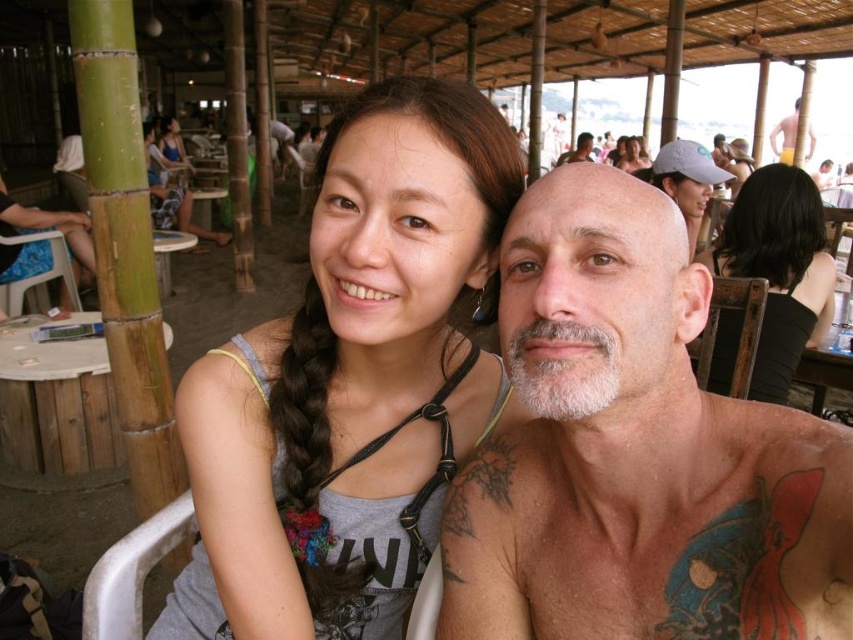
Does matte blue tank top at upper left have a lesser height compared to matte gray tank top at upper center?

In fact, matte blue tank top at upper left may be taller than matte gray tank top at upper center.

Between point (151, 196) and point (178, 129), which one is positioned behind?

Positioned behind is point (178, 129).

Which is in front, point (160, 160) or point (161, 150)?

Point (160, 160) is in front.

Where is `matte blue tank top at upper left`? matte blue tank top at upper left is located at coordinates (171, 195).

Is point (700, 173) closer to camera compared to point (785, 161)?

That is True.

Consider the image. Can you confirm if white matte baseball cap at upper center is thinner than smooth yellow towel at upper right?

No, white matte baseball cap at upper center is not thinner than smooth yellow towel at upper right.

Which is behind, point (659, 179) or point (788, 120)?

The point (788, 120) is behind.

Locate an element on the screen. Image resolution: width=853 pixels, height=640 pixels. white matte baseball cap at upper center is located at coordinates coord(685,180).

Based on the photo, does bald man with tattoos at center have a lesser height compared to black hair at upper center?

Yes.

Measure the distance between bald man with tattoos at center and black hair at upper center.

bald man with tattoos at center and black hair at upper center are 1.55 meters apart from each other.

Who is more forward, (786, 522) or (793, 346)?

Point (786, 522)

The height and width of the screenshot is (640, 853). I want to click on bald man with tattoos at center, so click(x=635, y=452).